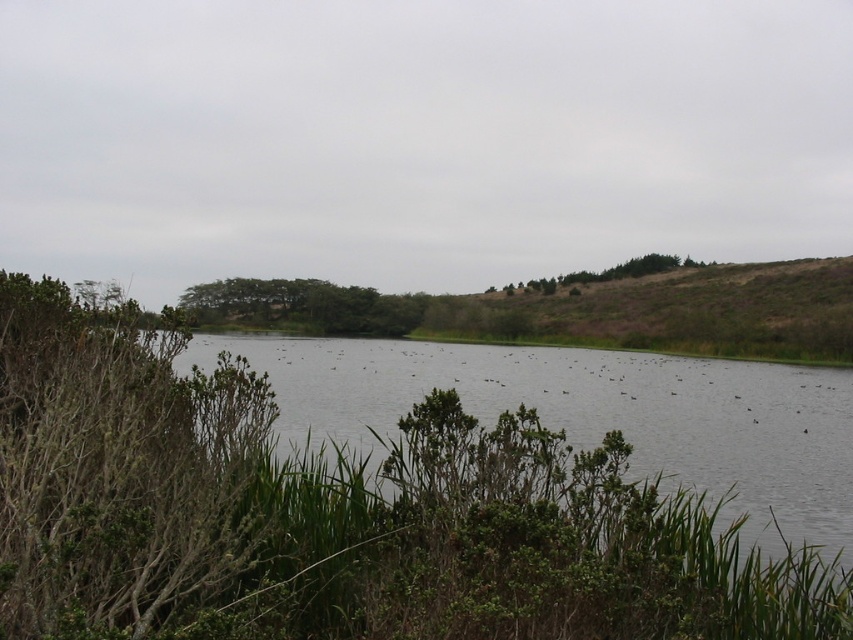
Question: Observing the image, what is the correct spatial positioning of green leafy tree at center in reference to green leafy tree at upper center?

Choices:
 (A) above
 (B) below

Answer: (B)

Question: Can you confirm if green leafy tree at center is positioned above green leafy tree at upper center?

Choices:
 (A) yes
 (B) no

Answer: (B)

Question: Based on their relative distances, which object is nearer to the green leafy tree at upper center?

Choices:
 (A) clear water at center
 (B) green leafy tree at center

Answer: (B)

Question: Considering the real-world distances, which object is closest to the green leafy tree at upper center?

Choices:
 (A) clear water at center
 (B) green leafy tree at center

Answer: (B)

Question: Based on their relative distances, which object is farther from the green leafy tree at center?

Choices:
 (A) green leafy tree at upper center
 (B) clear water at center

Answer: (A)

Question: Can you confirm if green leafy tree at center is smaller than green leafy tree at upper center?

Choices:
 (A) yes
 (B) no

Answer: (B)